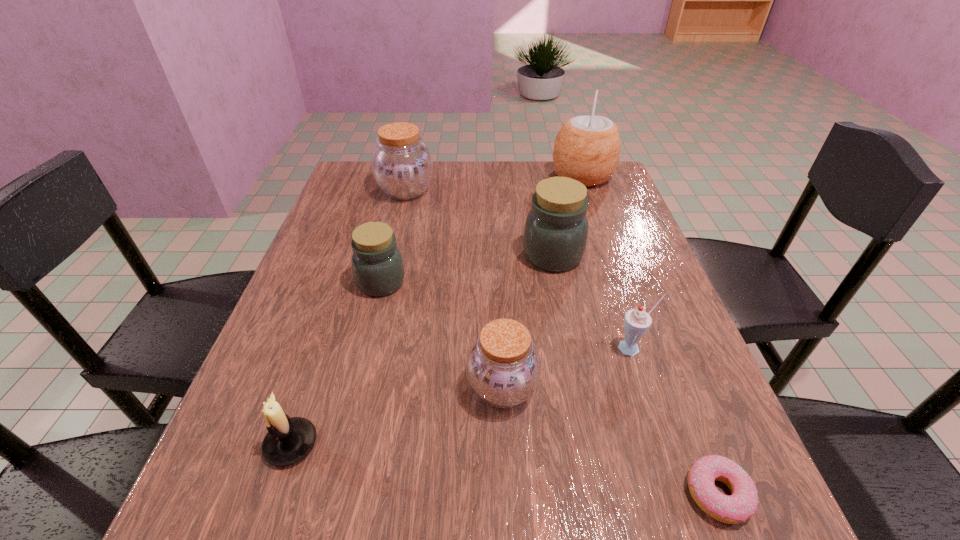
Where is `object that is positioned at the near right corner`? The width and height of the screenshot is (960, 540). object that is positioned at the near right corner is located at coordinates (742, 504).

What are the coordinates of `vacant space at the far edge` in the screenshot? It's located at (457, 179).

Where is `free space at the near edge of the desktop`? This screenshot has height=540, width=960. free space at the near edge of the desktop is located at coordinates (492, 511).

At what (x,y) coordinates should I click in order to perform the action: click on free spot at the left edge of the desktop. Please return your answer as a coordinate pair (x, y). This screenshot has width=960, height=540. Looking at the image, I should click on (352, 211).

Identify the location of vacant space at the right edge of the desktop. Image resolution: width=960 pixels, height=540 pixels. (660, 395).

Find the location of a particular element. The image size is (960, 540). vacant point located between the tallest object and the milkshake is located at coordinates (608, 262).

Where is `vacant point located between the third nearest object and the white candle holder`? This screenshot has height=540, width=960. vacant point located between the third nearest object and the white candle holder is located at coordinates (396, 416).

Identify the location of vacant area between the smaller brown jar and the milkshake. The height and width of the screenshot is (540, 960). [x=567, y=368].

You are a GUI agent. You are given a task and a screenshot of the screen. Output one action in this format:
    pyautogui.click(x=<x>, y=<y>)
    Task: Click on the vacant space that is in between the pink doughnut and the left green jar
    
    Given the screenshot: What is the action you would take?
    pyautogui.click(x=549, y=388)

Where is `free point between the nearest jar and the white candle holder`? This screenshot has width=960, height=540. free point between the nearest jar and the white candle holder is located at coordinates (396, 416).